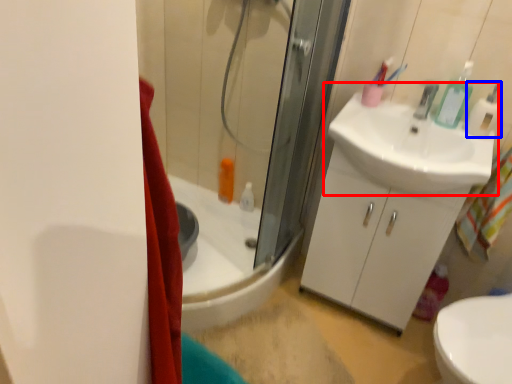
Question: Which point is closer to the camera, sink (highlighted by a red box) or soap dispenser (highlighted by a blue box)?

Choices:
 (A) sink
 (B) soap dispenser

Answer: (A)